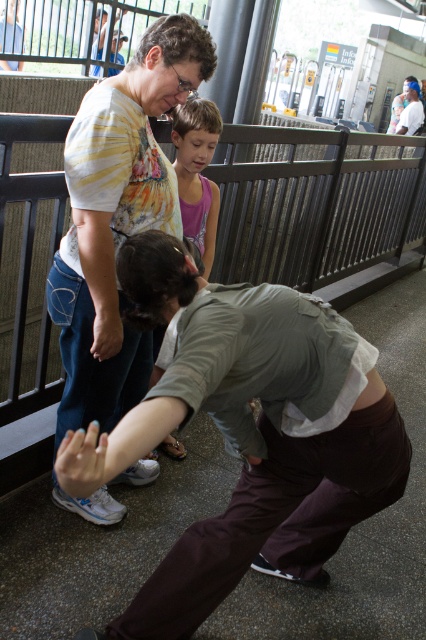
You are a photographer at the train station and want to capture both the brown cotton pants at lower center and the striped cotton shirt at upper left in the same frame. Which object should you position your camera closer to in order to include both in the shot?

To include both the brown cotton pants at lower center and the striped cotton shirt at upper left in the same frame, position your camera closer to the striped cotton shirt at upper left since the brown cotton pants at lower center is to the right of it, allowing for a wider angle to capture both.

Based on the scene described, if you were standing at the position of the woman in the tie dye shirt, which object would be to your right side, the metallic gray fence at upper center or the pink fabric shirt at center?

The metallic gray fence at upper center is to the right of the pink fabric shirt at center. Since the woman is standing to the left of the scene, facing towards the other individuals, the metallic gray fence at upper center would be on her right side.

You are standing at the transportation hub and want to find the ticket machines labeled Info. You see the brown cotton pants at lower center and the metallic gray fence at upper center. Which object is closer to your eye level?

The metallic gray fence at upper center is closer to your eye level since it is positioned higher than the brown cotton pants at lower center, which is located below it.